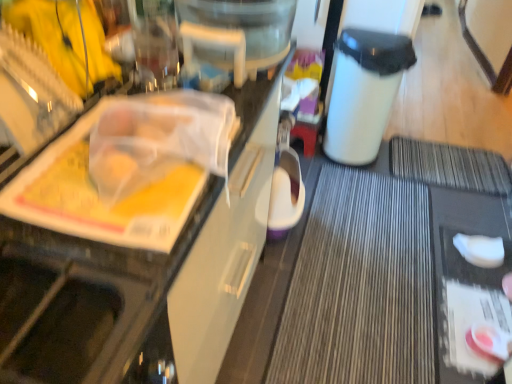
Locate an element on the screen. The width and height of the screenshot is (512, 384). vacant area to the left of white matte sponge at lower right, which appears as the first food when viewed from the back is located at coordinates (443, 262).